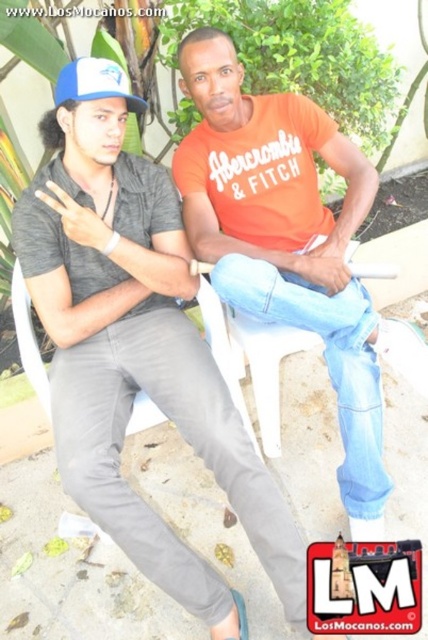
You are designing a storage box for the gray cotton shirt at left and the blue fabric baseball cap at upper left. Which item requires a wider storage space based on their sizes?

The gray cotton shirt at left requires a wider storage space because its width is larger than the blue fabric baseball cap at upper left.